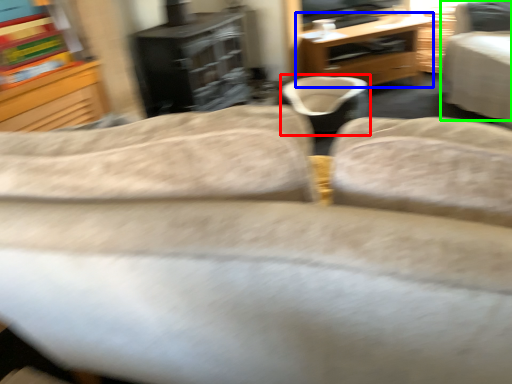
Question: Considering the real-world distances, which object is farthest from bean bag chair (highlighted by a red box)? desk (highlighted by a blue box) or chair (highlighted by a green box)?

Choices:
 (A) desk
 (B) chair

Answer: (B)